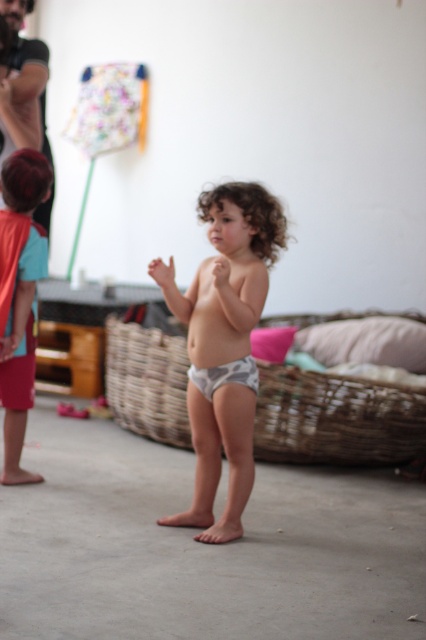
Between gray-patterned diaper at center and gray fabric diaper at center, which one has less height?

Standing shorter between the two is gray fabric diaper at center.

Which is behind, point (195, 348) or point (247, 376)?

The point (195, 348) is more distant.

Identify the location of gray-patterned diaper at center. (224, 346).

Can you confirm if gray-patterned diaper at center is positioned below matte red shorts at left?

Indeed, gray-patterned diaper at center is positioned under matte red shorts at left.

Is gray-patterned diaper at center thinner than matte red shorts at left?

No, gray-patterned diaper at center is not thinner than matte red shorts at left.

Is point (210, 208) positioned in front of point (5, 448)?

That is True.

At what (x,y) coordinates should I click in order to perform the action: click on gray-patterned diaper at center. Please return your answer as a coordinate pair (x, y). This screenshot has height=640, width=426. Looking at the image, I should click on (224, 346).

Does matte red shorts at left have a lesser width compared to gray fabric diaper at center?

Yes.

Which is behind, point (13, 248) or point (215, 381)?

Positioned behind is point (13, 248).

Where is `matte red shorts at left`? matte red shorts at left is located at coordinates (20, 294).